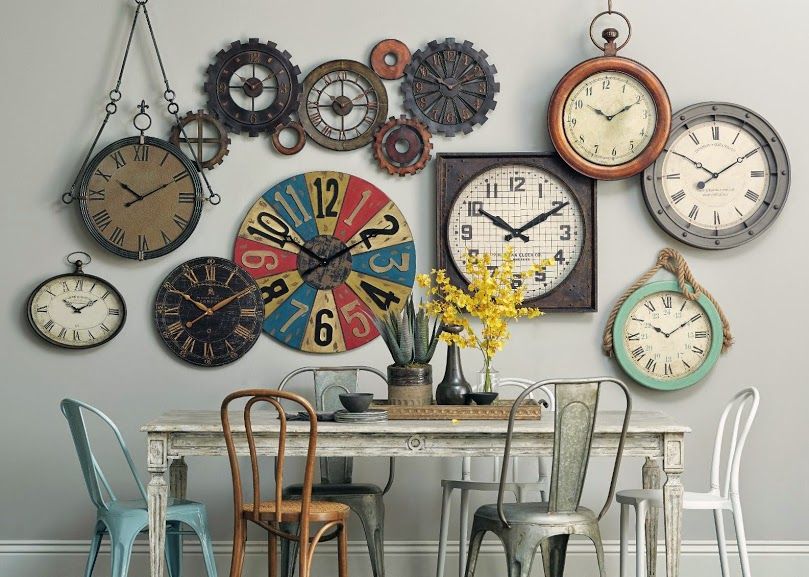
Find the location of a particular element. chair is located at coordinates (126, 524), (306, 516), (365, 499), (528, 520), (716, 500), (464, 482).